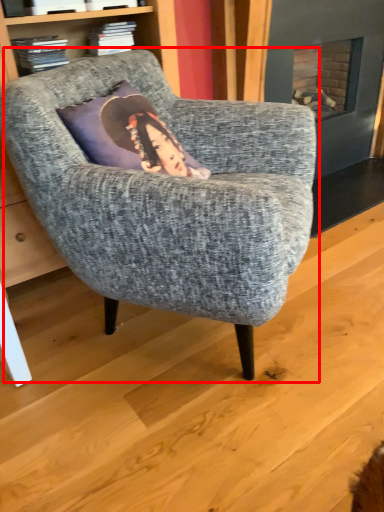
Question: From the image's perspective, considering the relative positions of chair (annotated by the red box) and book in the image provided, where is chair (annotated by the red box) located with respect to the staircase?

Choices:
 (A) below
 (B) above

Answer: (A)